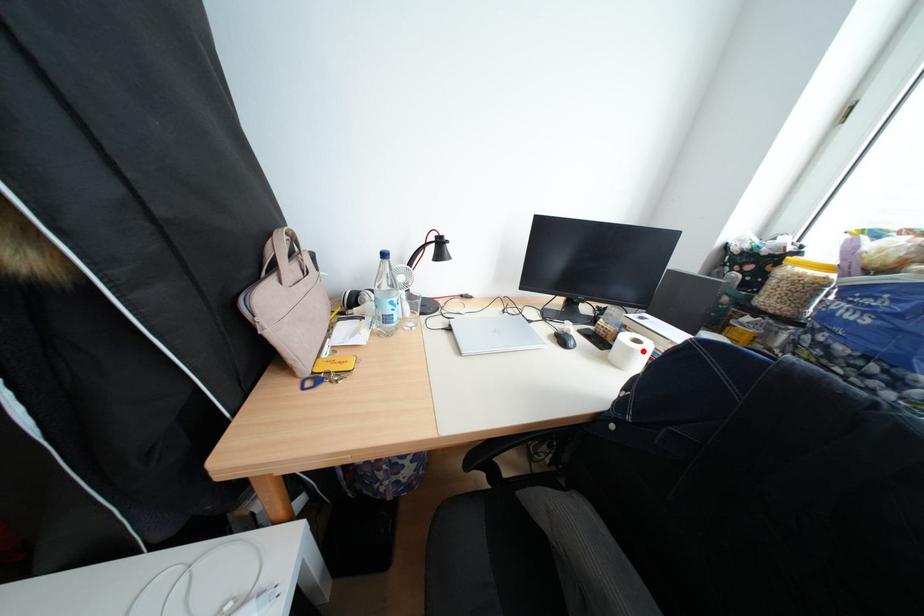
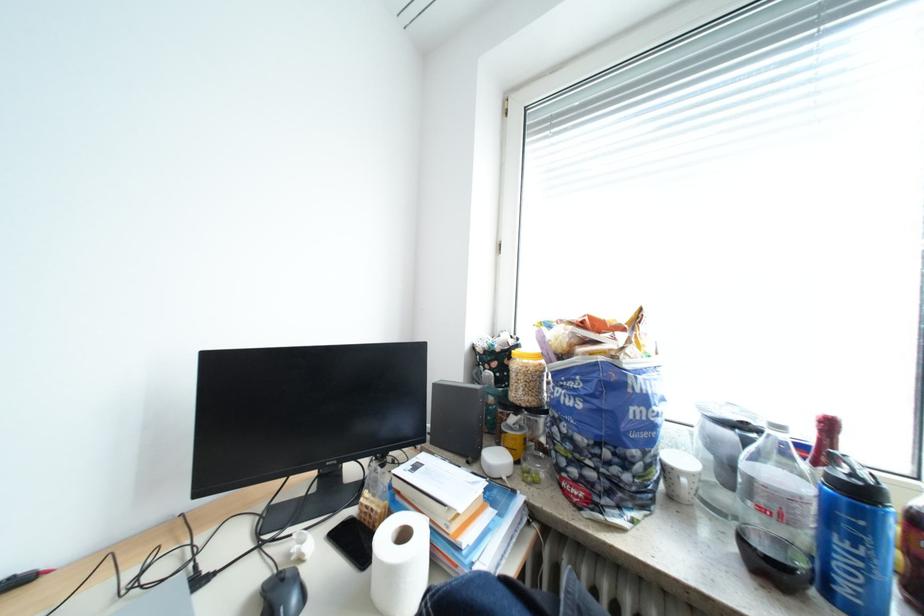
The point at the highlighted location is marked in the first image. Where is the corresponding point in the second image?

(404, 573)